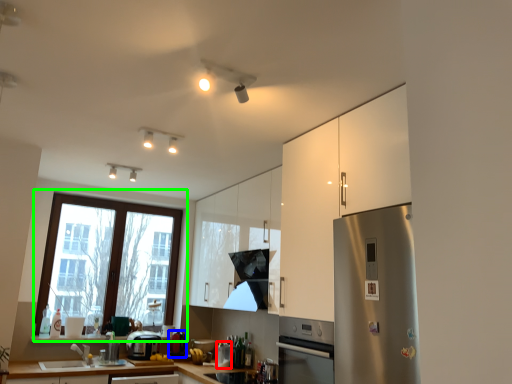
Question: Which object is the farthest from appliance (highlighted by a red box)? Choose among these: appliance (highlighted by a blue box) or window (highlighted by a green box).

Choices:
 (A) appliance
 (B) window

Answer: (B)